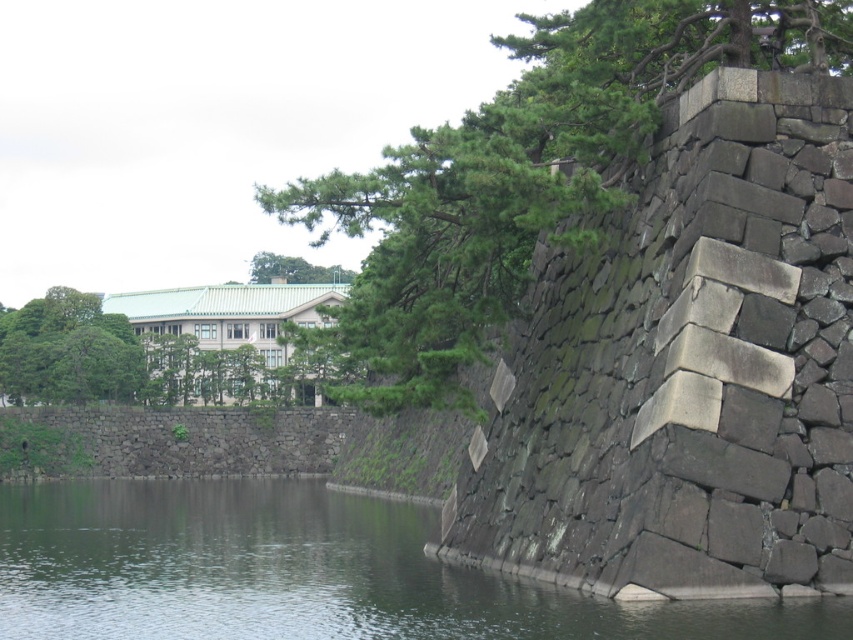
Can you confirm if green stone wall at lower left is wider than green leafy tree at upper center?

Correct, the width of green stone wall at lower left exceeds that of green leafy tree at upper center.

Does point (556, 604) come farther from viewer compared to point (287, 257)?

No, it is not.

Between point (276, 518) and point (289, 257), which one is positioned behind?

Positioned behind is point (289, 257).

The width and height of the screenshot is (853, 640). Find the location of `green stone wall at lower left`. green stone wall at lower left is located at coordinates (305, 573).

Which of these two, green leafy tree at upper right or green leafy tree at upper left, stands shorter?

green leafy tree at upper left is shorter.

Looking at this image, which is more to the right, green leafy tree at upper right or green leafy tree at upper left?

green leafy tree at upper right is more to the right.

Is point (645, 129) farther from camera compared to point (80, 332)?

No, it is not.

Locate an element on the screen. The height and width of the screenshot is (640, 853). green leafy tree at upper right is located at coordinates (527, 172).

Between green leafy tree at upper right and green leafy tree at upper center, which one is positioned higher?

green leafy tree at upper right

Who is more distant from viewer, (556, 124) or (305, 275)?

Positioned behind is point (305, 275).

This screenshot has width=853, height=640. Identify the location of green leafy tree at upper right. (527, 172).